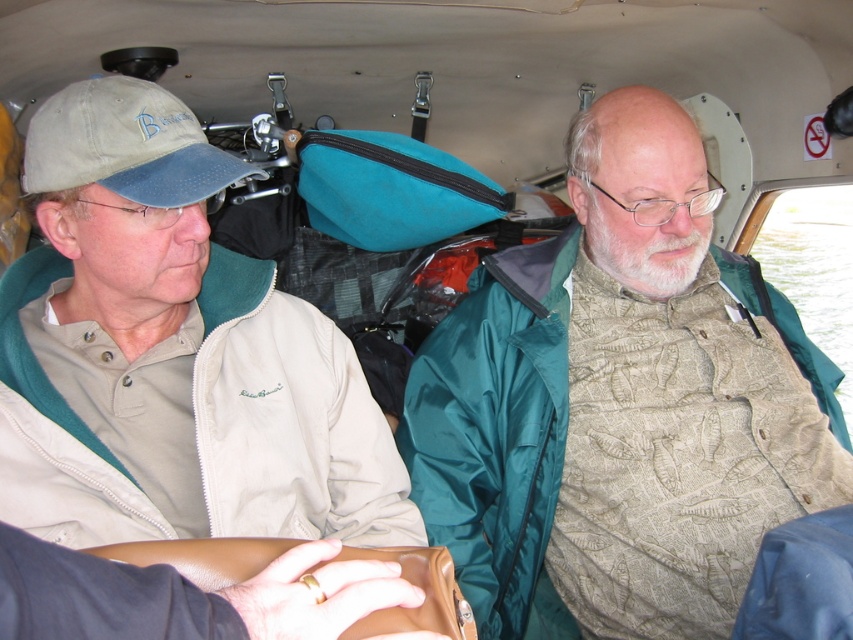
You are a flight attendant preparing to distribute emergency equipment. You need to place a large first aid kit between the green textured jacket at center and the beige fleece jacket at left. Which jacket should you place the kit closer to based on their sizes?

The green textured jacket at center is bigger than the beige fleece jacket at left, so the first aid kit should be placed closer to the green textured jacket at center to accommodate its size.

You are a flight attendant on a small aircraft. You need to hand a safety manual to both the person wearing the green textured jacket at center and the person wearing the khaki fabric baseball cap at left. If the manual is 12 inches long, can you pass it between them without needing to move either passenger?

The green textured jacket at center and the khaki fabric baseball cap at left are 30.17 inches apart. Since the manual is only 12 inches long, it can easily be passed between them without needing to move either passenger.

You are a passenger in the aircraft and need to retrieve your item stored above the beige fleece jacket at left. Can you reach it while the green textured jacket at center is in its current position?

The green textured jacket at center is below the beige fleece jacket at left, so it is not blocking the storage area above the beige fleece jacket at left. Therefore, you can reach the item stored there.